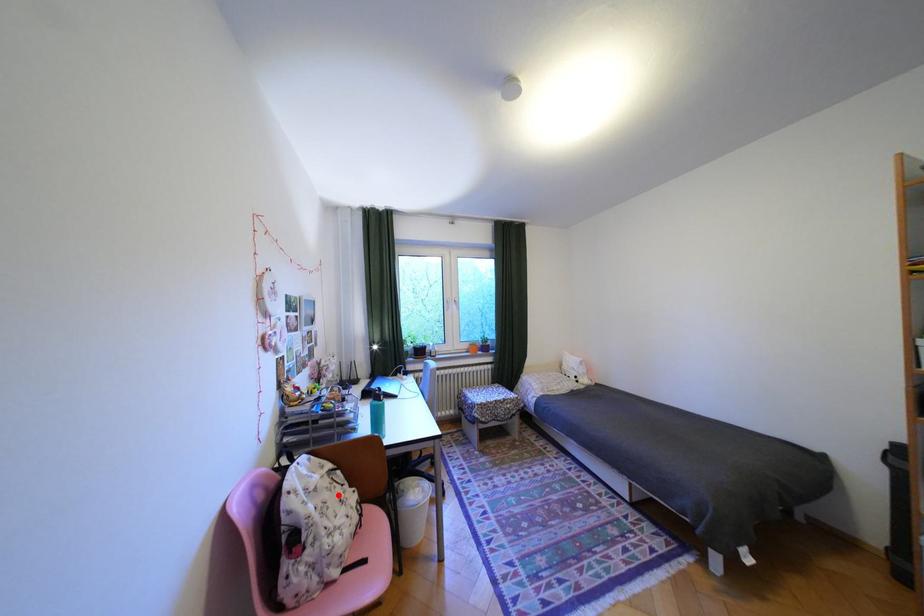
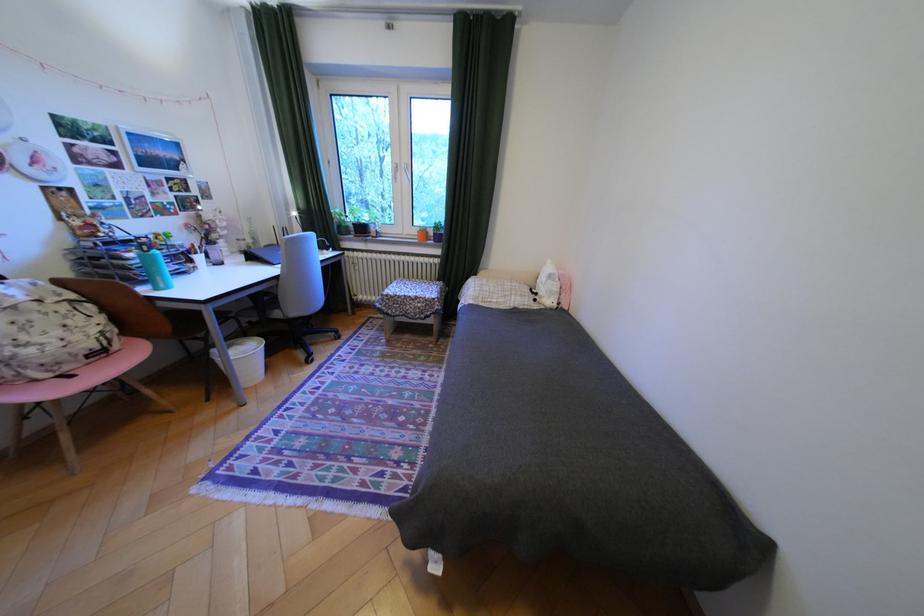
Question: A red point is marked in image1. In image2, is the corresponding 3D point closer to the camera or farther? Reply with the corresponding letter.

Choices:
 (A) The corresponding 3D point is closer.
 (B) The corresponding 3D point is farther.

Answer: (B)